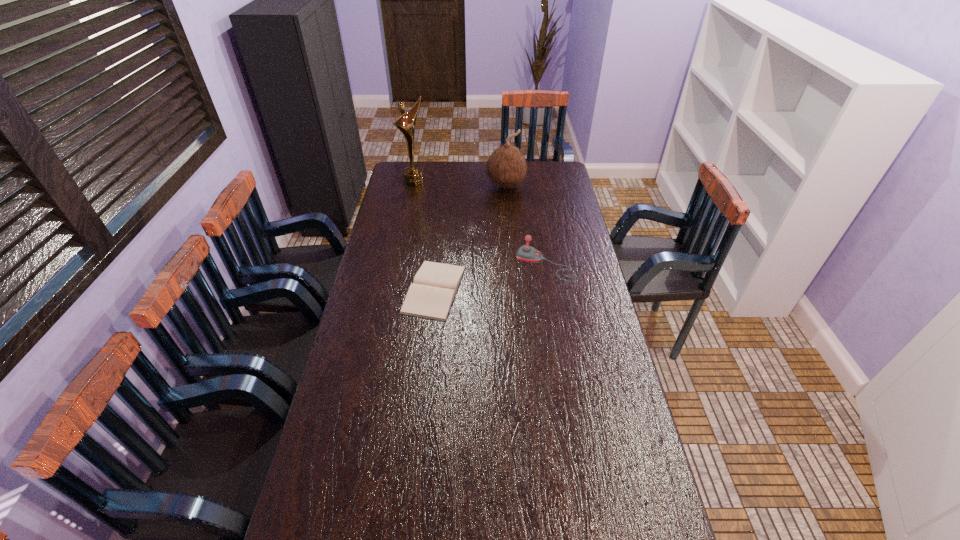
The image size is (960, 540). What are the coordinates of `free location located on the surface of the second tallest object` in the screenshot? It's located at (501, 217).

This screenshot has height=540, width=960. Identify the location of blank space located on the surface of the second tallest object. (501, 215).

Image resolution: width=960 pixels, height=540 pixels. Identify the location of award present at the far edge. (413, 175).

The image size is (960, 540). In order to click on coconut at the far edge in this screenshot , I will do `click(506, 167)`.

Find the location of a particular element. This screenshot has width=960, height=540. Bible that is positioned at the left edge is located at coordinates (431, 295).

Locate an element on the screen. The image size is (960, 540). award that is positioned at the left edge is located at coordinates (413, 175).

The height and width of the screenshot is (540, 960). In order to click on object present at the right edge in this screenshot , I will do `click(527, 253)`.

The height and width of the screenshot is (540, 960). I want to click on object located in the far left corner section of the desktop, so click(x=413, y=175).

What are the coordinates of `vacant space at the far edge` in the screenshot? It's located at (492, 184).

Locate an element on the screen. The image size is (960, 540). blank space at the near edge is located at coordinates (582, 527).